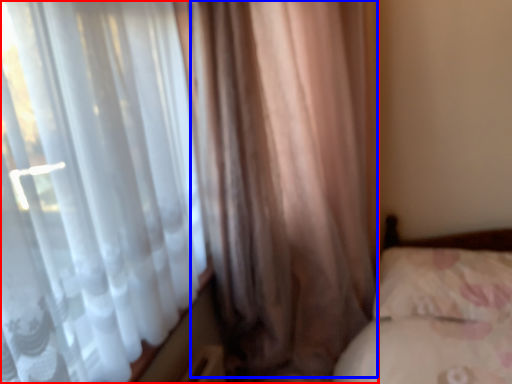
Question: Which object is further to the camera taking this photo, curtain (highlighted by a red box) or curtain (highlighted by a blue box)?

Choices:
 (A) curtain
 (B) curtain

Answer: (B)